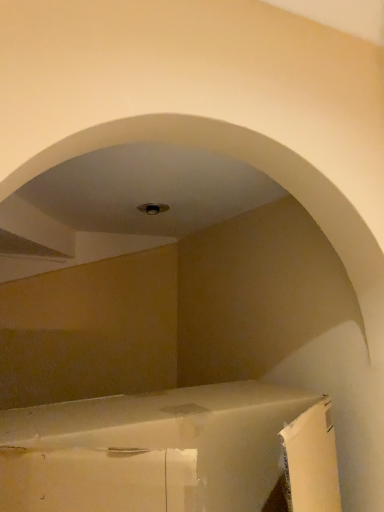
Locate an element on the screen. Image resolution: width=384 pixels, height=512 pixels. white glossy cabinet at lower left is located at coordinates (173, 452).

What do you see at coordinates (173, 452) in the screenshot? I see `white glossy cabinet at lower left` at bounding box center [173, 452].

This screenshot has height=512, width=384. In order to click on white glossy cabinet at lower left in this screenshot , I will do `click(173, 452)`.